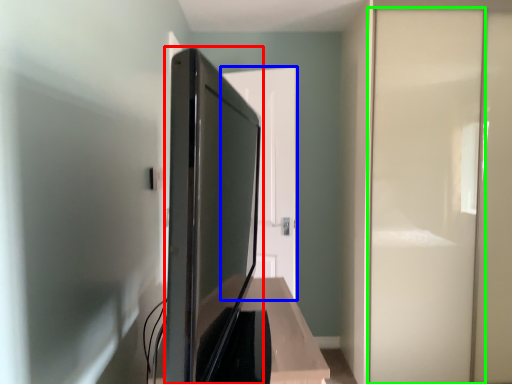
Question: Which is nearer to the appliance (highlighted by a red box)? door (highlighted by a blue box) or screen door (highlighted by a green box).

Choices:
 (A) door
 (B) screen door

Answer: (A)